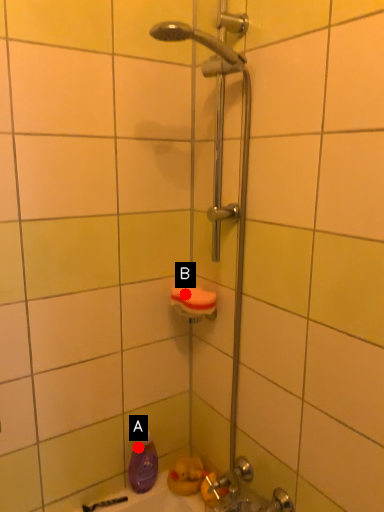
Question: Two points are circled on the image, labeled by A and B beside each circle. Which point is closer to the camera?

Choices:
 (A) A is closer
 (B) B is closer

Answer: (B)